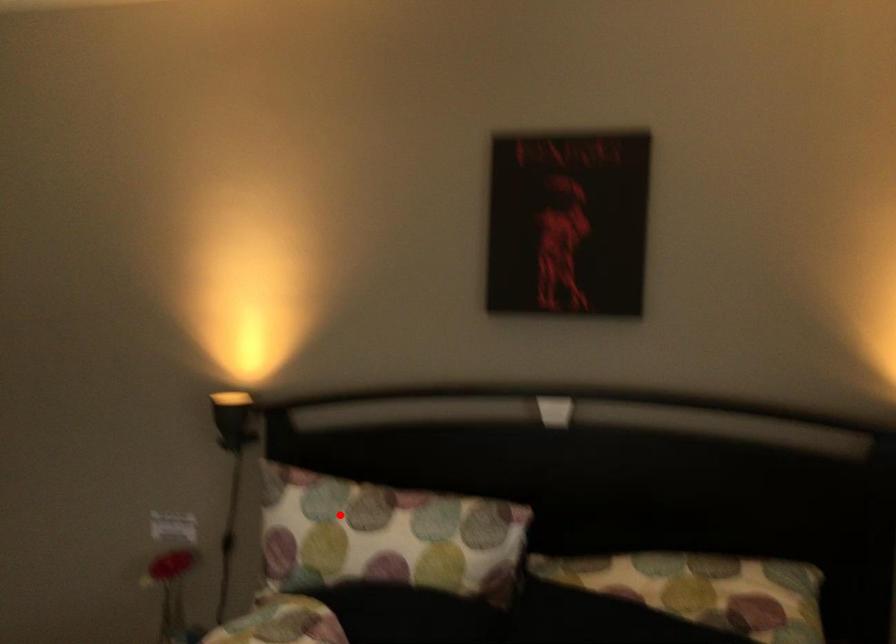
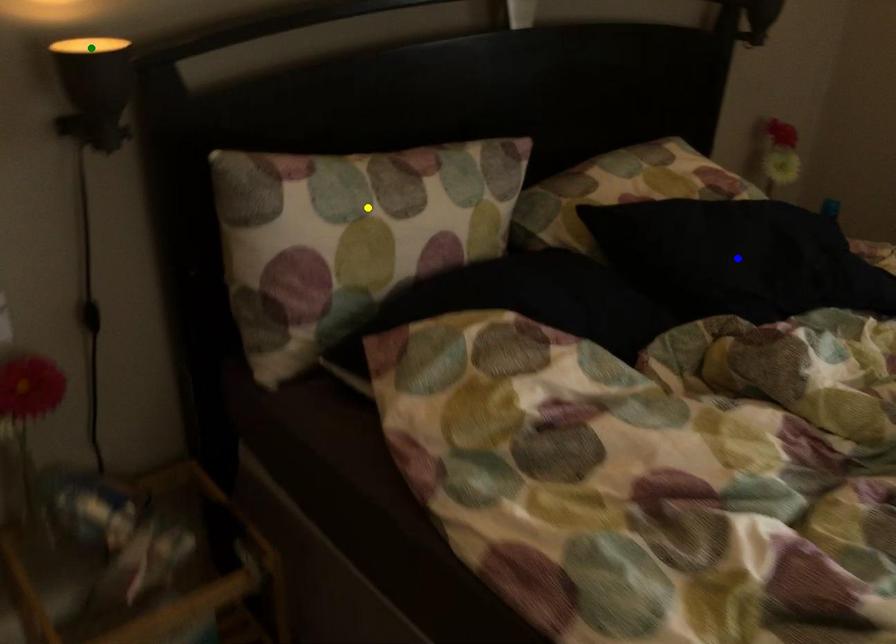
Question: I am providing you with two images of the same scene from different viewpoints. A red point is marked on the first image. You are given multiple points on the second image. Which point in image 2 is actually the same real-world point as the red point in image 1?

Choices:
 (A) yellow point
 (B) green point
 (C) blue point

Answer: (A)